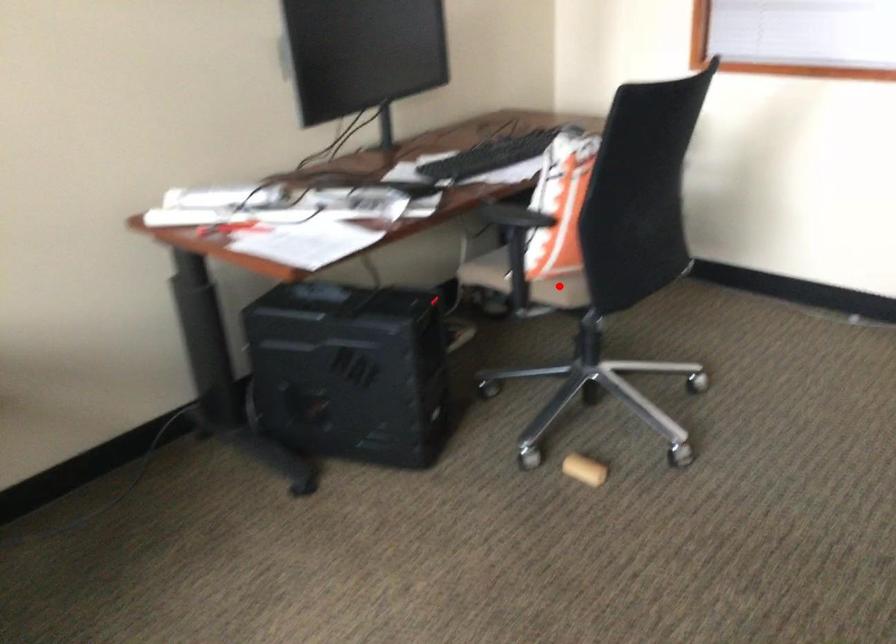
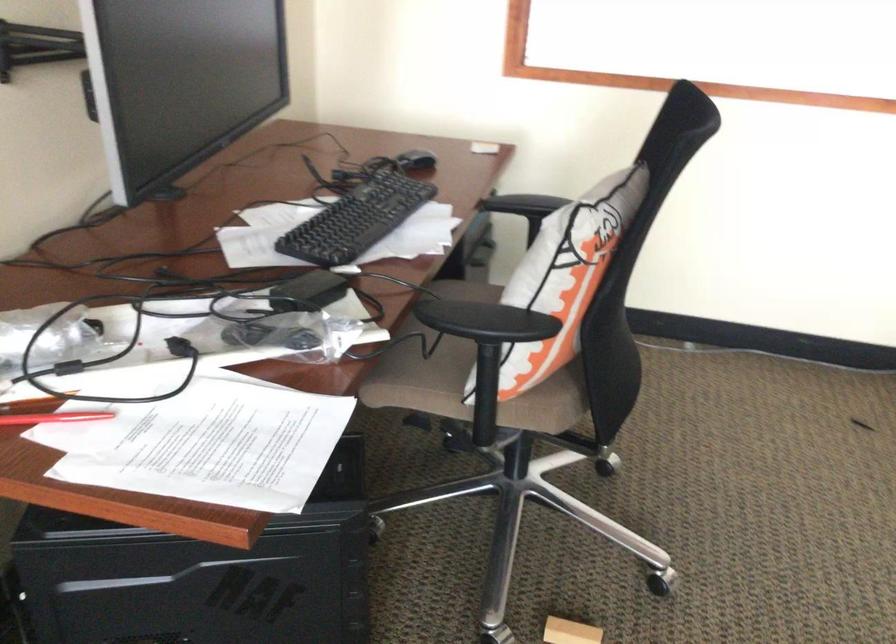
In the second image, find the point that corresponds to the highlighted location in the first image.

(543, 408)